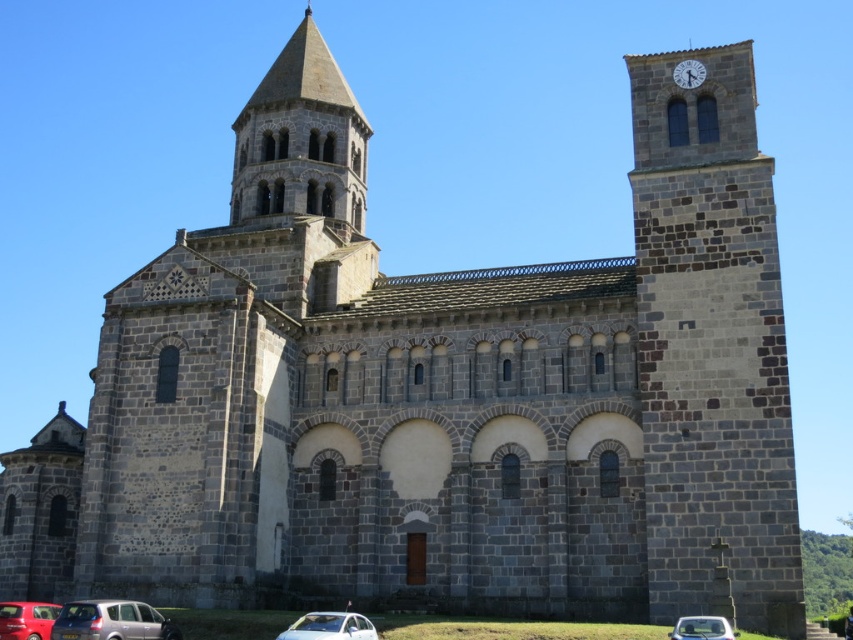
You are a tourist standing at the entrance of the historic stone church. You notice the dark gray stone clock tower at right and the silver metallic car at lower center. Which object is significantly taller?

The dark gray stone clock tower at right is much taller than the silver metallic car at lower center.

You are driving a silver metallic car at lower center and want to park it near the dark gray stone clock tower at right. However, there is a narrow alley between them. Can you park the car close to the tower without crossing the alley?

The dark gray stone clock tower at right is positioned on the right side of the silver metallic car at lower center, so the alley between them is narrow. Since the car is already at the lower center and the tower is to the right, parking closer would require moving towards the right, but the alley width isn not specified. However, based on their positions, the car can likely maneuver into the alley next to the tower without crossing it if the space allows.

You are standing at the entrance of the historic stone church and want to park your white matte car at lower right. Given the coordinates provided, can you determine if the parking spot at point 0.983, 0.824 is suitable for your car?

The white matte car at lower right is positioned at point (701, 628), so yes, the parking spot at that coordinate is suitable for your car.